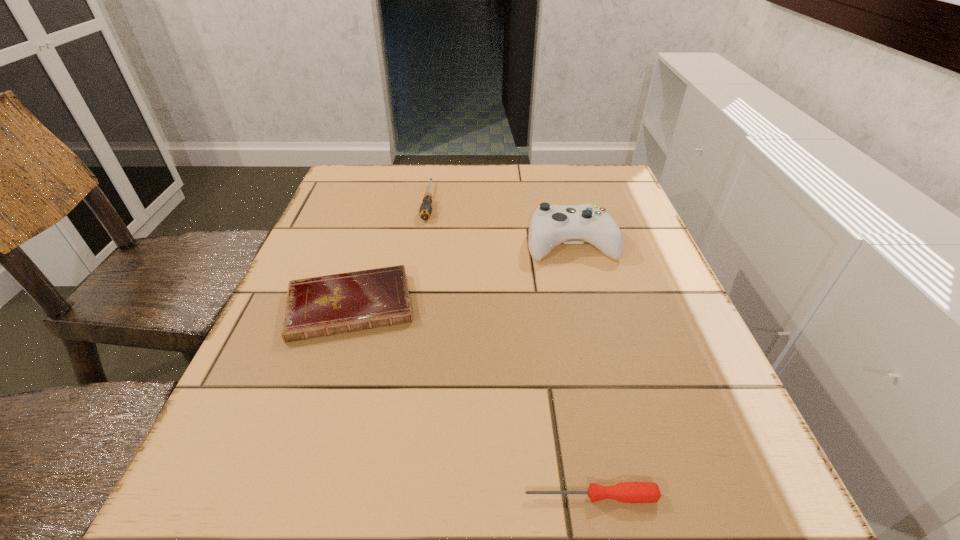
Where is `unoccupied area between the second tallest object and the notebook`? unoccupied area between the second tallest object and the notebook is located at coordinates (390, 254).

The height and width of the screenshot is (540, 960). Identify the location of empty space that is in between the nearer screwdriver and the farthest object. (510, 349).

Identify the location of vacant space that is in between the farthest object and the nearer screwdriver. The height and width of the screenshot is (540, 960). (510, 349).

Locate an element on the screen. This screenshot has width=960, height=540. free space between the third shortest object and the notebook is located at coordinates (390, 254).

At what (x,y) coordinates should I click in order to perform the action: click on vacant area between the farthest object and the shorter screwdriver. Please return your answer as a coordinate pair (x, y). The width and height of the screenshot is (960, 540). Looking at the image, I should click on (510, 349).

Choose which object is the nearest neighbor to the third nearest object. Please provide its 2D coordinates. Your answer should be formatted as a tuple, i.e. [(x, y)], where the tuple contains the x and y coordinates of a point satisfying the conditions above.

[(425, 210)]

Identify which object is the closest to the third farthest object. Please provide its 2D coordinates. Your answer should be formatted as a tuple, i.e. [(x, y)], where the tuple contains the x and y coordinates of a point satisfying the conditions above.

[(425, 210)]